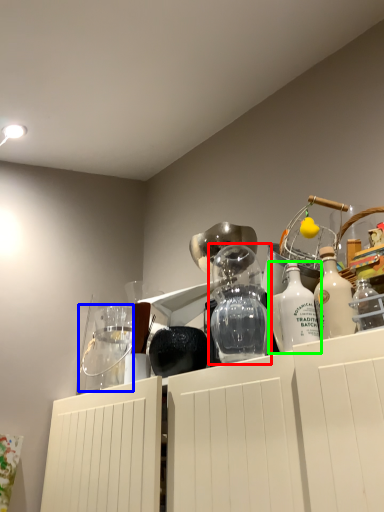
Question: Which object is positioned farthest from glass vase (highlighted by a red box)? Select from glass jar (highlighted by a blue box) and bottle (highlighted by a green box).

Choices:
 (A) glass jar
 (B) bottle

Answer: (A)